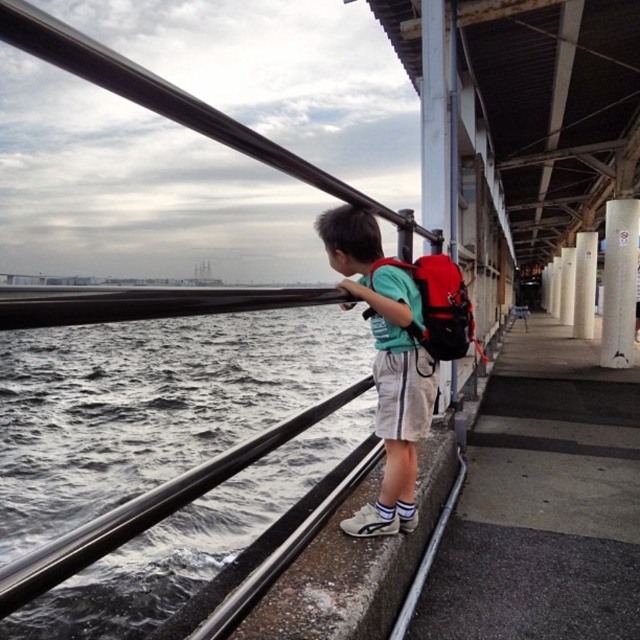
Can you confirm if gray matte water at left is wider than green fabric backpack at center?

Correct, the width of gray matte water at left exceeds that of green fabric backpack at center.

Who is more forward, (141, 324) or (340, 244)?

Point (340, 244) is in front.

The height and width of the screenshot is (640, 640). In order to click on gray matte water at left in this screenshot , I will do pos(150,404).